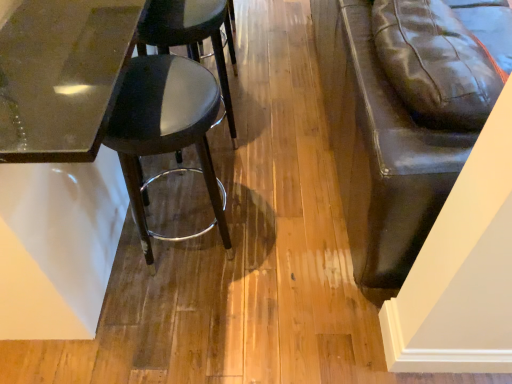
Where is `free spot to the right of black leather stool at center, positioned as the 1th stool in top-to-bottom order`? Image resolution: width=512 pixels, height=384 pixels. free spot to the right of black leather stool at center, positioned as the 1th stool in top-to-bottom order is located at coordinates (270, 146).